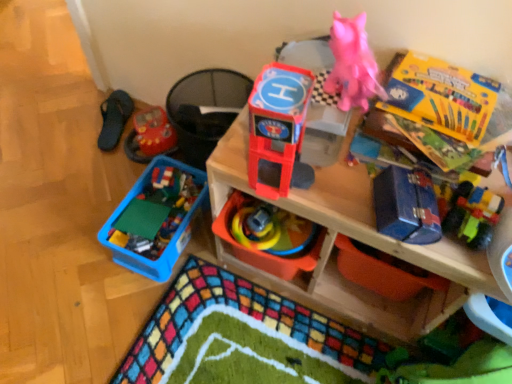
Identify the location of vacant area that is in front of yellow cardboard box at upper right, arranged as the first storage box when viewed from the top. The image size is (512, 384). (451, 146).